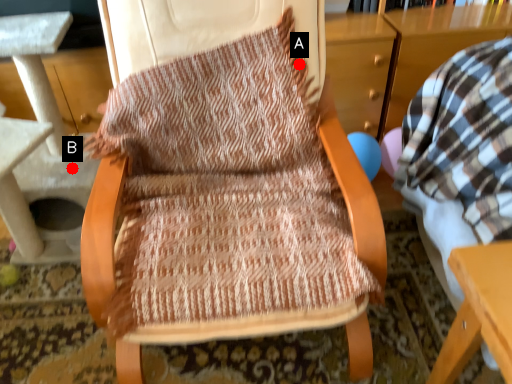
Question: Two points are circled on the image, labeled by A and B beside each circle. Which point appears farthest from the camera in this image?

Choices:
 (A) A is further
 (B) B is further

Answer: (B)